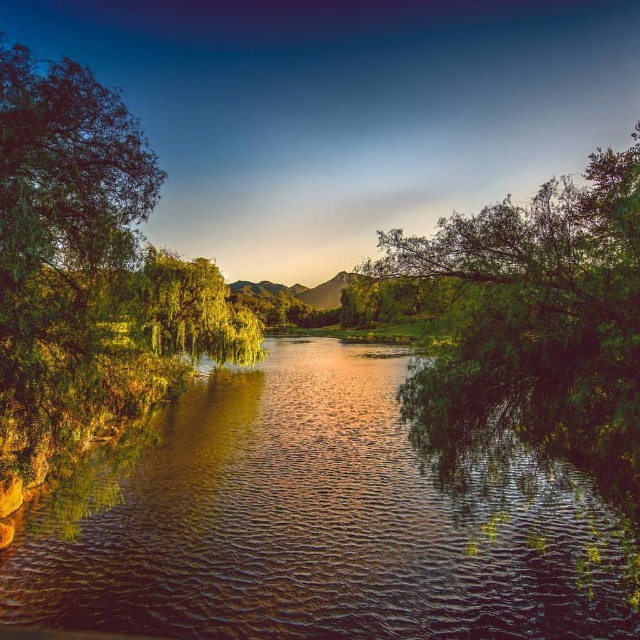
Question: Can you confirm if green leafy tree at left is positioned to the left of green leafy tree at right?

Choices:
 (A) yes
 (B) no

Answer: (A)

Question: Among these objects, which one is nearest to the camera?

Choices:
 (A) green leafy tree at right
 (B) green leafy tree at left
 (C) shiny reflective water at center

Answer: (A)

Question: Does shiny reflective water at center appear under green leafy tree at right?

Choices:
 (A) no
 (B) yes

Answer: (B)

Question: Which object appears closest to the camera in this image?

Choices:
 (A) green leafy tree at right
 (B) green leafy tree at left
 (C) shiny reflective water at center

Answer: (A)

Question: Can you confirm if shiny reflective water at center is thinner than green leafy tree at right?

Choices:
 (A) no
 (B) yes

Answer: (B)

Question: Which object appears farthest from the camera in this image?

Choices:
 (A) green leafy tree at right
 (B) shiny reflective water at center
 (C) green leafy tree at left

Answer: (B)